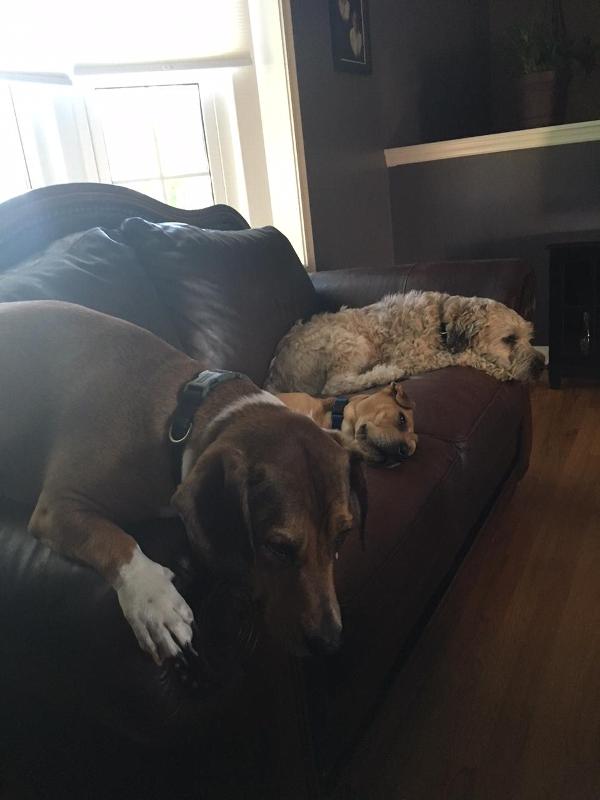
Locate an element on the screen. Image resolution: width=600 pixels, height=800 pixels. wall is located at coordinates (369, 134).